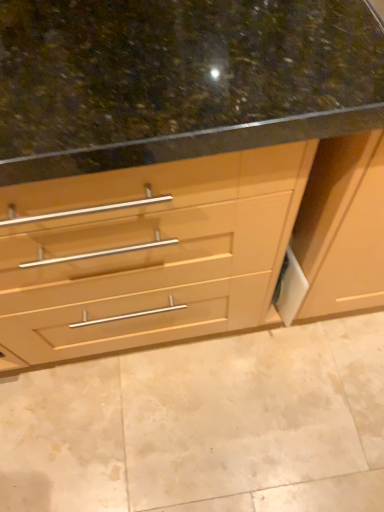
Describe the element at coordinates (234, 417) in the screenshot. This screenshot has width=384, height=512. I see `brown polished granite at center` at that location.

Image resolution: width=384 pixels, height=512 pixels. In order to click on brown polished granite at center in this screenshot , I will do `click(234, 417)`.

Identify the location of matte wood cabinet at center. The height and width of the screenshot is (512, 384). (184, 170).

Describe the element at coordinates (184, 170) in the screenshot. This screenshot has height=512, width=384. I see `matte wood cabinet at center` at that location.

Locate an element on the screen. The height and width of the screenshot is (512, 384). brown polished granite at center is located at coordinates (234, 417).

Is matte wood cabinet at center to the right of brown polished granite at center from the viewer's perspective?

Yes, matte wood cabinet at center is to the right of brown polished granite at center.

Is the position of matte wood cabinet at center more distant than that of brown polished granite at center?

No.

Which is in front, point (171, 295) or point (331, 468)?

The point (171, 295) is closer to the camera.

From the image's perspective, which object appears higher, matte wood cabinet at center or brown polished granite at center?

matte wood cabinet at center, from the image's perspective.

From a real-world perspective, which object stands above the other?

matte wood cabinet at center is physically above.

Is matte wood cabinet at center wider than brown polished granite at center?

Incorrect, the width of matte wood cabinet at center does not surpass that of brown polished granite at center.

Is matte wood cabinet at center taller than brown polished granite at center?

Correct, matte wood cabinet at center is much taller as brown polished granite at center.

Does matte wood cabinet at center have a smaller size compared to brown polished granite at center?

Incorrect, matte wood cabinet at center is not smaller in size than brown polished granite at center.

Is matte wood cabinet at center not inside brown polished granite at center?

That's correct, matte wood cabinet at center is outside of brown polished granite at center.

Is matte wood cabinet at center directly adjacent to brown polished granite at center?

matte wood cabinet at center is not next to brown polished granite at center, and they're not touching.

Does matte wood cabinet at center turn towards brown polished granite at center?

Yes, matte wood cabinet at center faces towards brown polished granite at center.

Can you tell me how much matte wood cabinet at center and brown polished granite at center differ in facing direction?

They differ by 89.5 degrees in their facing directions.

Find the location of a particular element. cabinetry on the right of brown polished granite at center is located at coordinates (184, 170).

Can you confirm if brown polished granite at center is positioned to the left of matte wood cabinet at center?

Yes, brown polished granite at center is to the left of matte wood cabinet at center.

Which object is further away from the camera taking this photo, brown polished granite at center or matte wood cabinet at center?

brown polished granite at center is further from the camera.

Is point (280, 467) positioned behind point (54, 12)?

Yes.

From the image's perspective, which object appears higher, brown polished granite at center or matte wood cabinet at center?

matte wood cabinet at center.

From a real-world perspective, which object rests below the other?

brown polished granite at center, from a real-world perspective.

Between brown polished granite at center and matte wood cabinet at center, which one has smaller width?

matte wood cabinet at center is thinner.

Can you confirm if brown polished granite at center is taller than matte wood cabinet at center?

Incorrect, the height of brown polished granite at center is not larger of that of matte wood cabinet at center.

Considering the sizes of objects brown polished granite at center and matte wood cabinet at center in the image provided, who is bigger, brown polished granite at center or matte wood cabinet at center?

matte wood cabinet at center.

Is brown polished granite at center outside of matte wood cabinet at center?

brown polished granite at center is positioned outside matte wood cabinet at center.

Is brown polished granite at center far from matte wood cabinet at center?

No, there isn't a large distance between brown polished granite at center and matte wood cabinet at center.

Is brown polished granite at center oriented towards matte wood cabinet at center?

No, brown polished granite at center is not oriented towards matte wood cabinet at center.

Where is `cabinetry that is above the brown polished granite at center (from a real-world perspective)`? cabinetry that is above the brown polished granite at center (from a real-world perspective) is located at coordinates (184, 170).

The height and width of the screenshot is (512, 384). What are the coordinates of `granite below the matte wood cabinet at center (from the image's perspective)` in the screenshot? It's located at (234, 417).

Locate an element on the screen. Image resolution: width=384 pixels, height=512 pixels. granite that appears on the left of matte wood cabinet at center is located at coordinates (234, 417).